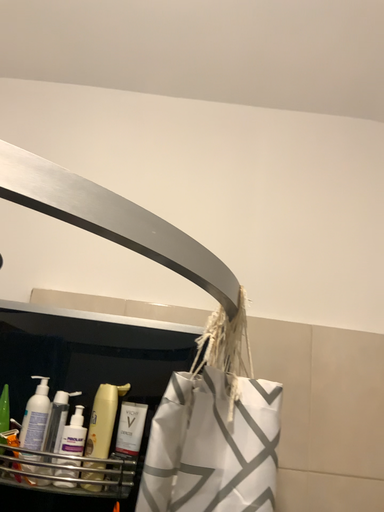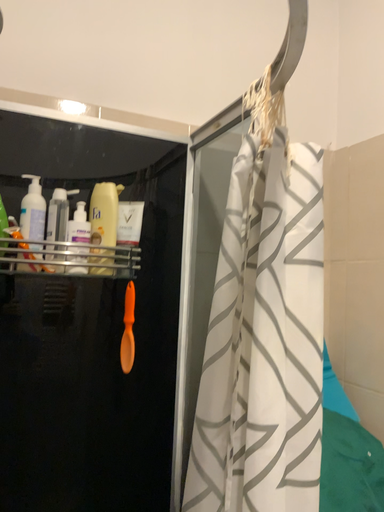
Question: How did the camera likely rotate when shooting the video?

Choices:
 (A) rotated upward
 (B) rotated downward

Answer: (B)